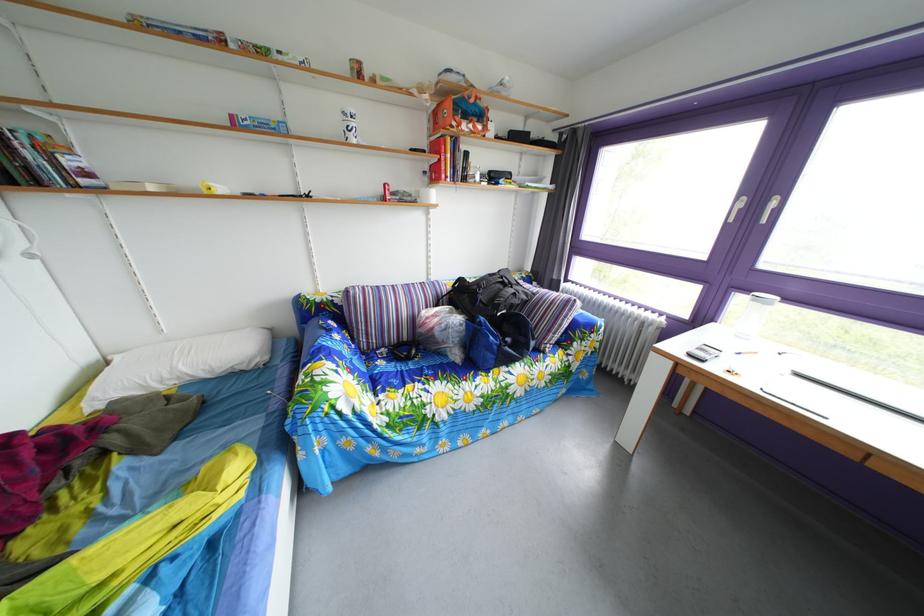
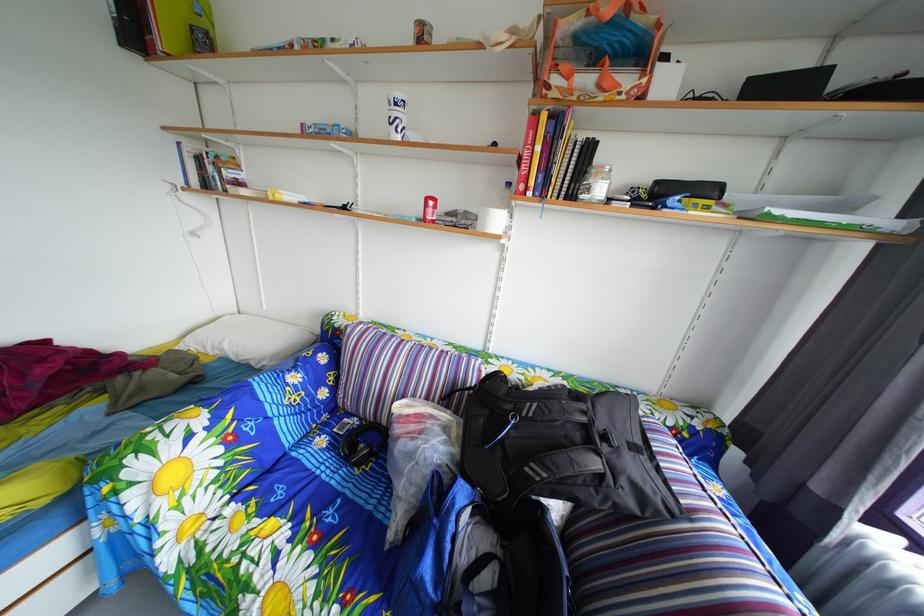
Find the pixel in the second image that matches [394,358] in the first image.

(367, 428)